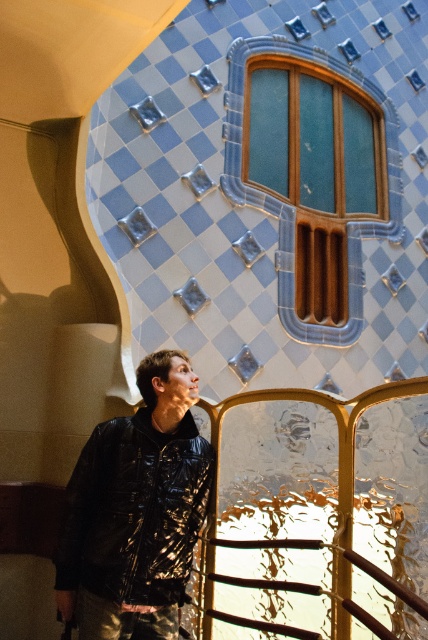
Question: Which point is closer to the camera?

Choices:
 (A) shiny black jacket at center
 (B) teal glass window at upper center

Answer: (A)

Question: Does shiny black jacket at center appear over teal glass window at upper center?

Choices:
 (A) no
 (B) yes

Answer: (A)

Question: Which object is farther from the camera taking this photo?

Choices:
 (A) teal glass window at upper center
 (B) shiny black jacket at center

Answer: (A)

Question: Is shiny black jacket at center bigger than teal glass window at upper center?

Choices:
 (A) yes
 (B) no

Answer: (B)

Question: Can you confirm if shiny black jacket at center is positioned to the right of teal glass window at upper center?

Choices:
 (A) no
 (B) yes

Answer: (A)